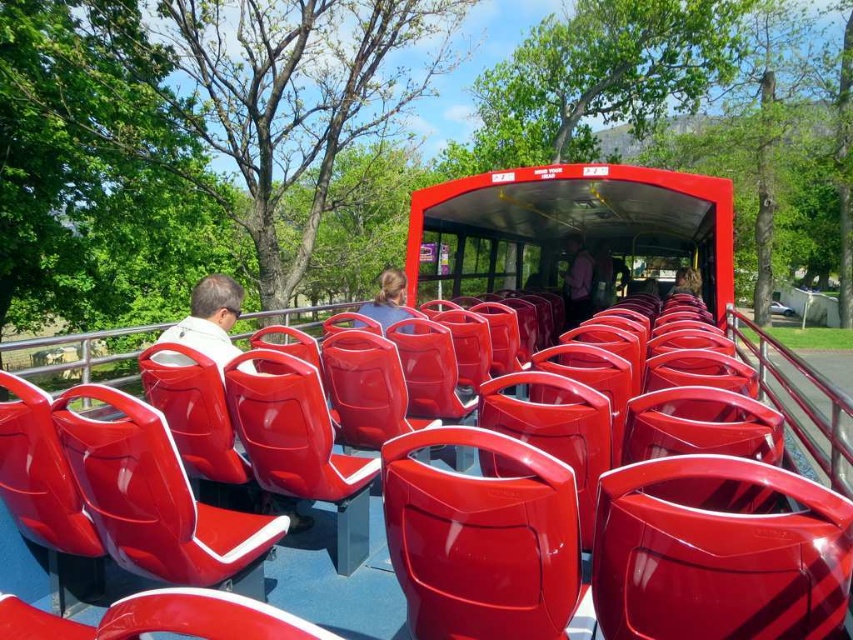
The height and width of the screenshot is (640, 853). What do you see at coordinates (210, 317) in the screenshot?
I see `matte white shirt at left` at bounding box center [210, 317].

Can you confirm if matte white shirt at left is bigger than pink fabric shirt at center?

No, matte white shirt at left is not bigger than pink fabric shirt at center.

This screenshot has width=853, height=640. I want to click on matte white shirt at left, so click(x=210, y=317).

Is matte white shirt at left smaller than matte blue shirt at center?

Correct, matte white shirt at left occupies less space than matte blue shirt at center.

Find the location of a particular element. matte white shirt at left is located at coordinates (210, 317).

Does pink fabric shirt at center have a smaller size compared to matte blue shirt at center?

Incorrect, pink fabric shirt at center is not smaller in size than matte blue shirt at center.

Can you confirm if pink fabric shirt at center is thinner than matte blue shirt at center?

Incorrect, pink fabric shirt at center's width is not less than matte blue shirt at center's.

Between point (579, 314) and point (399, 308), which one is positioned in front?

Positioned in front is point (399, 308).

Where is `pink fabric shirt at center`? The height and width of the screenshot is (640, 853). pink fabric shirt at center is located at coordinates (577, 282).